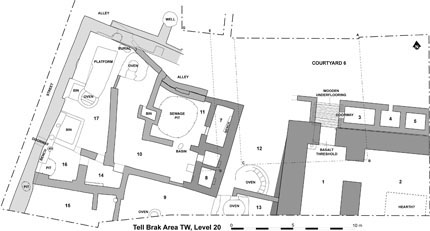
Locate an element on the screen. This screenshot has width=430, height=231. floor plan is located at coordinates (213, 126).